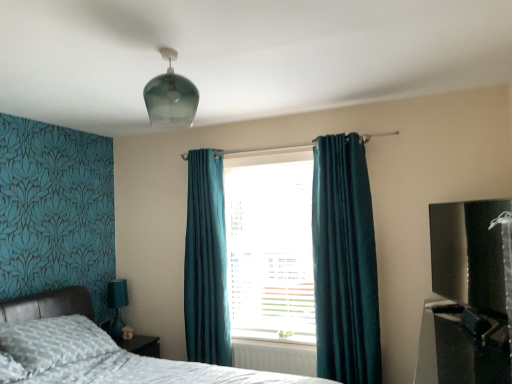
Question: From the image's perspective, relative to teal fabric lampshade at lower left, is black plastic entertainment center at lower right, which is counted as the 1th entertainment center, starting from the bottom, above or below?

Choices:
 (A) below
 (B) above

Answer: (B)

Question: From a real-world perspective, is black plastic entertainment center at lower right, which is counted as the 1th entertainment center, starting from the bottom, physically located above or below teal fabric lampshade at lower left?

Choices:
 (A) above
 (B) below

Answer: (B)

Question: Which of these objects is positioned closest to the teal velvet curtain at center, placed as the second curtain when sorted from left to right?

Choices:
 (A) transparent glass light fixture at upper center
 (B) black glossy tv at right, which is the first entertainment center from top to bottom
 (C) patterned fabric bed at lower left
 (D) white plastic radiator at lower center
 (E) teal velvet curtain at center, positioned as the first curtain in left-to-right order

Answer: (D)

Question: Which object is positioned farthest from the white plastic radiator at lower center?

Choices:
 (A) teal velvet curtain at center, placed as the second curtain when sorted from left to right
 (B) teal fabric lampshade at lower left
 (C) teal fabric curtain at center
 (D) black glossy tv at right, marked as the 2th entertainment center in a bottom-to-top arrangement
 (E) black plastic entertainment center at lower right, which is counted as the 1th entertainment center, starting from the bottom

Answer: (D)